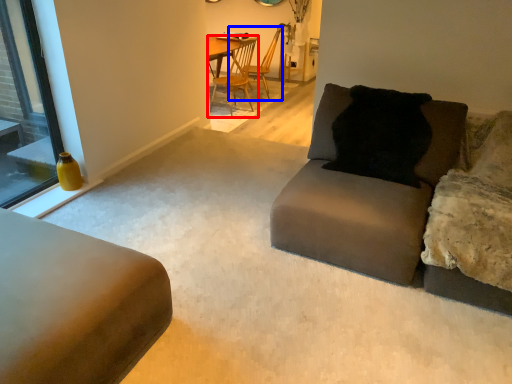
Question: Which of the following is the closest to the observer, chair (highlighted by a red box) or chair (highlighted by a blue box)?

Choices:
 (A) chair
 (B) chair

Answer: (A)